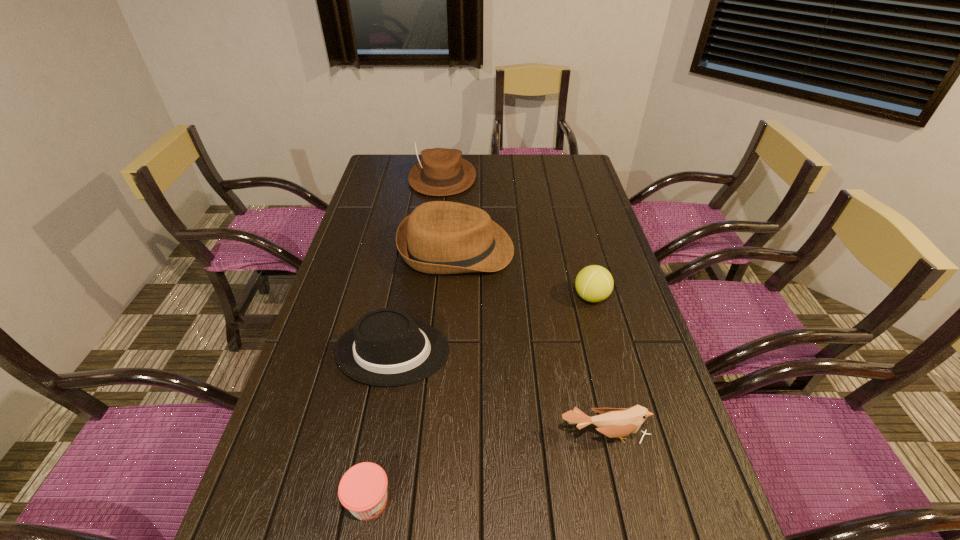
In order to click on free space located 0.080m on the front-facing side of the second shortest fedora in this screenshot , I will do `click(539, 249)`.

You are a GUI agent. You are given a task and a screenshot of the screen. Output one action in this format:
    pyautogui.click(x=<x>, y=<y>)
    Task: Click on the vacant space located on the front-facing side of the shortest fedora
    Image resolution: width=960 pixels, height=540 pixels.
    Given the screenshot: What is the action you would take?
    click(535, 352)

Where is `vacant space located 0.130m on the left of the third farthest object`? This screenshot has height=540, width=960. vacant space located 0.130m on the left of the third farthest object is located at coordinates (528, 297).

Where is `vacant space located at the beak of the bird`? Image resolution: width=960 pixels, height=540 pixels. vacant space located at the beak of the bird is located at coordinates (624, 524).

Locate an element on the screen. blank space located 0.180m on the front label of the jam is located at coordinates (484, 501).

This screenshot has width=960, height=540. In order to click on object that is at the far edge in this screenshot , I will do `click(442, 172)`.

Where is `tennis ball that is positioned at the right edge`? tennis ball that is positioned at the right edge is located at coordinates (594, 283).

The width and height of the screenshot is (960, 540). Find the location of `bird at the right edge`. bird at the right edge is located at coordinates (612, 422).

Find the location of `object located at the far left corner`. object located at the far left corner is located at coordinates (442, 172).

What are the coordinates of `free space at the far edge of the desktop` in the screenshot? It's located at [481, 159].